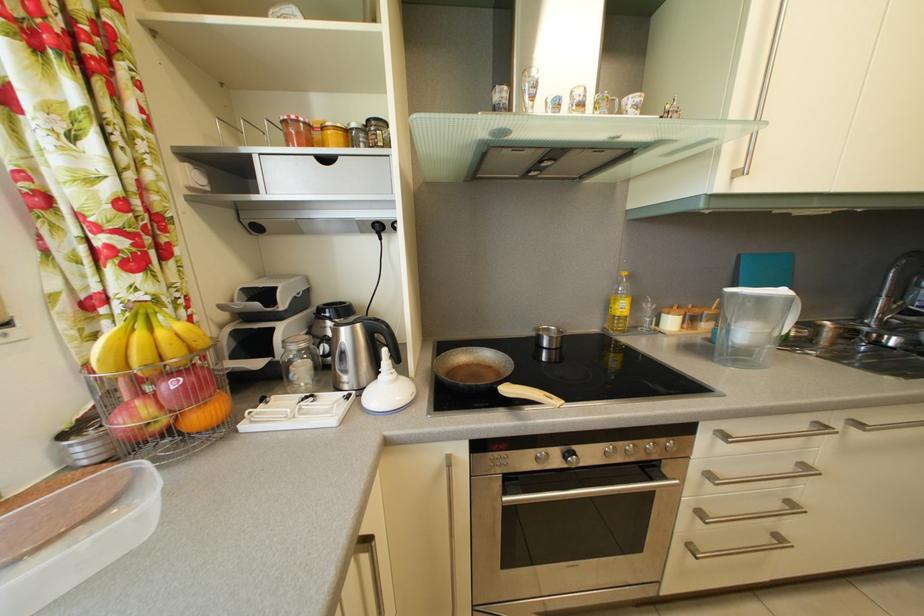
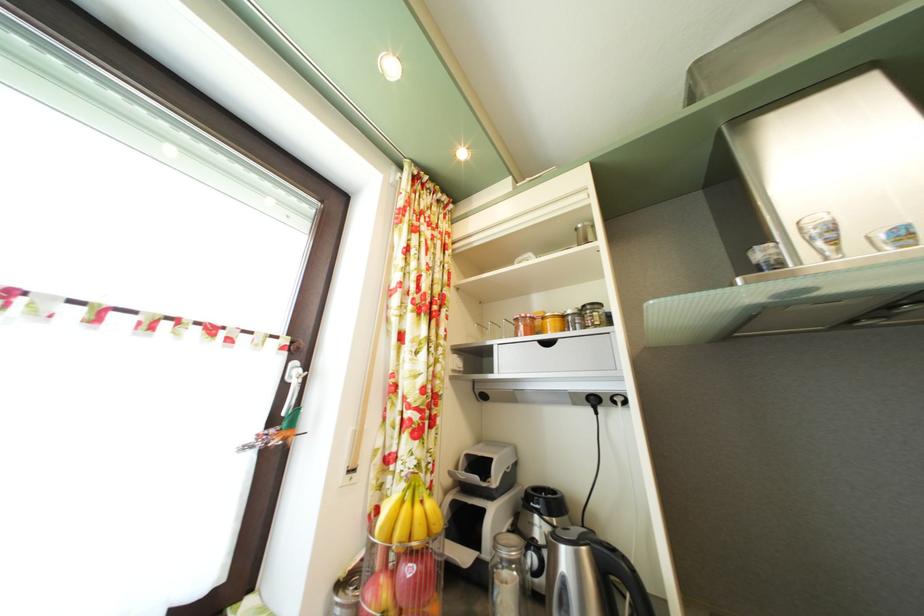
Find the pixel in the second image that matches [541,105] in the first image.

(843, 249)